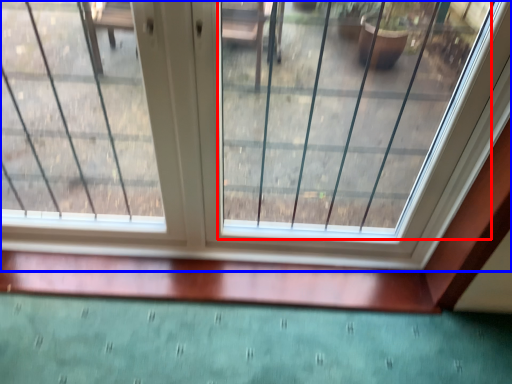
Question: Which of the following is the closest to the observer, glass window (highlighted by a red box) or window (highlighted by a blue box)?

Choices:
 (A) glass window
 (B) window

Answer: (A)